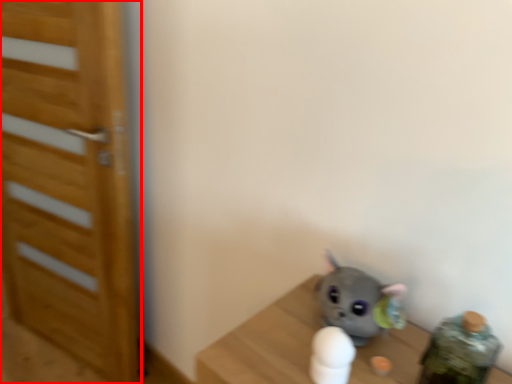
Question: From the image's perspective, considering the relative positions of door (annotated by the red box) and toy in the image provided, where is door (annotated by the red box) located with respect to the staircase?

Choices:
 (A) below
 (B) above

Answer: (B)